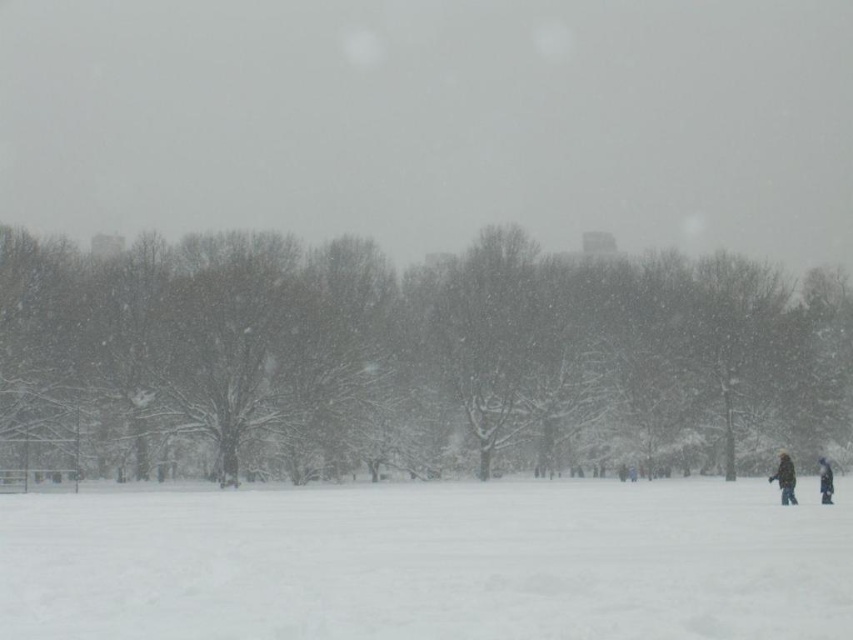
Between point (741, 492) and point (822, 488), which one is positioned in front?

Point (822, 488) is in front.

Who is more distant from viewer, (10,614) or (822,465)?

The point (822,465) is behind.

Who is more distant from viewer, (434,572) or (831,484)?

Point (831,484)

Where is `white fluffy snow at lower center`? The width and height of the screenshot is (853, 640). white fluffy snow at lower center is located at coordinates (428, 563).

What do you see at coordinates (428, 563) in the screenshot?
I see `white fluffy snow at lower center` at bounding box center [428, 563].

Which is behind, point (686, 604) or point (793, 492)?

The point (793, 492) is behind.

This screenshot has width=853, height=640. I want to click on white fluffy snow at lower center, so click(428, 563).

This screenshot has height=640, width=853. I want to click on white fluffy snow at lower center, so click(x=428, y=563).

Image resolution: width=853 pixels, height=640 pixels. Describe the element at coordinates (784, 477) in the screenshot. I see `brown fuzzy coat at lower right` at that location.

Is brown fuzzy coat at lower right to the left of dark blue jacket at lower right from the viewer's perspective?

Correct, you'll find brown fuzzy coat at lower right to the left of dark blue jacket at lower right.

The width and height of the screenshot is (853, 640). Describe the element at coordinates (784, 477) in the screenshot. I see `brown fuzzy coat at lower right` at that location.

Where is `brown fuzzy coat at lower right`? brown fuzzy coat at lower right is located at coordinates (784, 477).